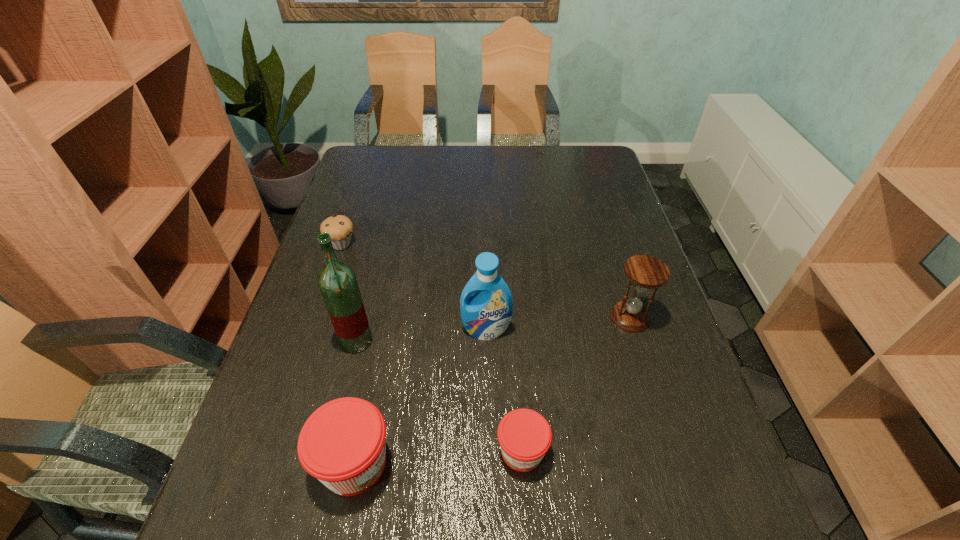
Where is `vacant point at the left edge`? vacant point at the left edge is located at coordinates (385, 201).

Locate an element on the screen. free region at the right edge of the desktop is located at coordinates (605, 284).

Where is `vacant space at the far left corner of the desktop`? Image resolution: width=960 pixels, height=540 pixels. vacant space at the far left corner of the desktop is located at coordinates (368, 166).

Identify the location of vacant space at the near left corner of the desktop. (262, 474).

This screenshot has width=960, height=540. Find the location of `free region at the far right corner of the desktop`. free region at the far right corner of the desktop is located at coordinates (609, 171).

Find the location of a particular element. The height and width of the screenshot is (540, 960). free space between the farthest object and the right jam is located at coordinates (431, 348).

This screenshot has width=960, height=540. What are the coordinates of `vacant area between the third shortest object and the leftmost object` in the screenshot? It's located at (348, 354).

This screenshot has height=540, width=960. I want to click on free area in between the third shortest object and the fourth shortest object, so click(492, 390).

The height and width of the screenshot is (540, 960). What are the coordinates of `vacant space in between the fourth tallest object and the hourglass` in the screenshot? It's located at (492, 390).

In order to click on free area in between the hourglass and the shorter jam in this screenshot , I will do `click(576, 384)`.